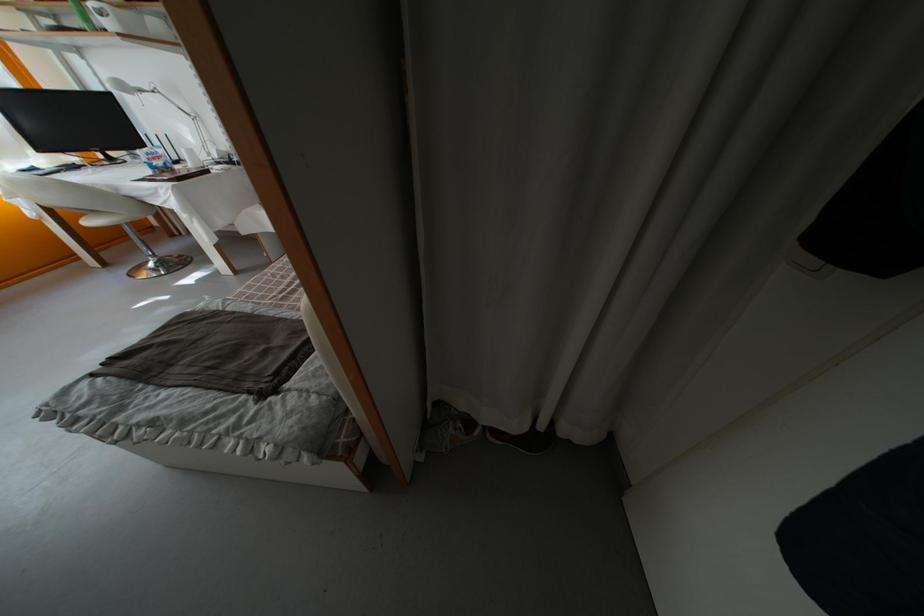
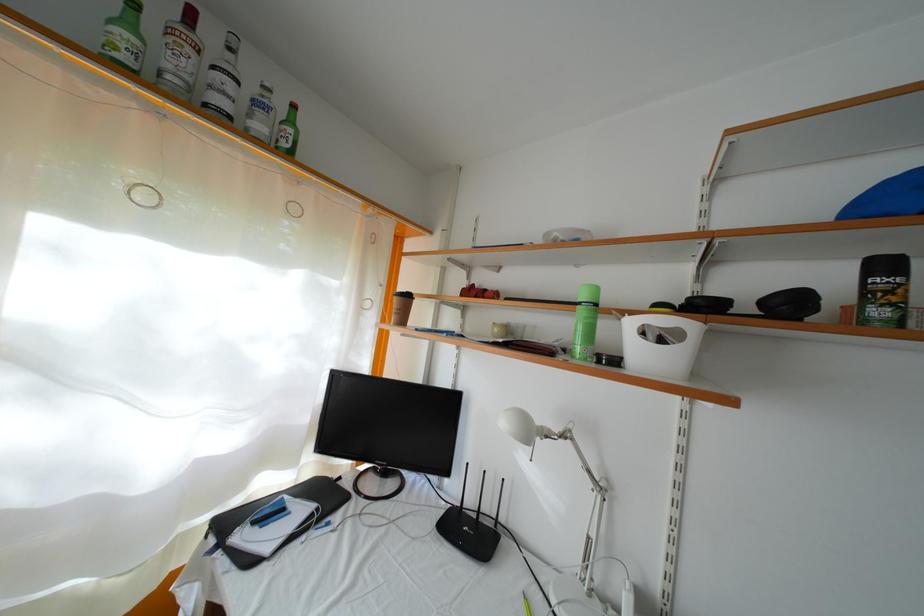
The point at (78,175) is marked in the first image. Where is the corresponding point in the second image?

(334, 506)